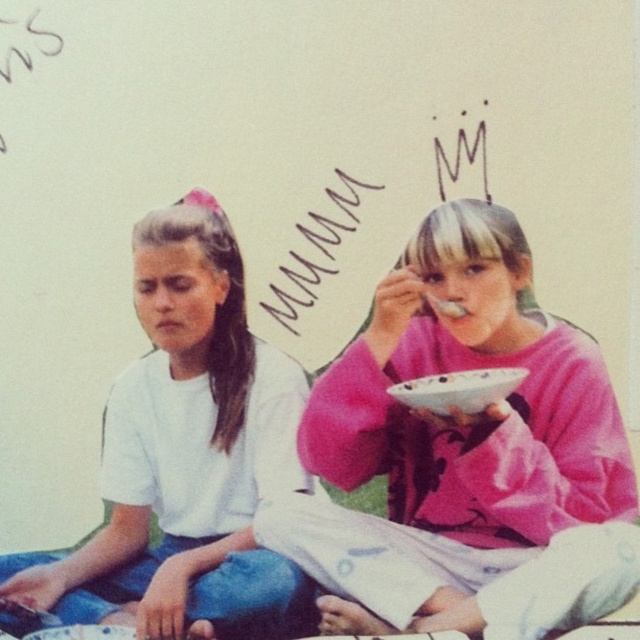
You are a photographer standing in front of the two girls and want to take a photo. You notice two points marked in the scene. The first point is at coordinates point (204, 253) and the second is at point (381, 256). Which point is closer to your camera?

Point (204, 253) is further to the camera than point (381, 256), so the second point is closer to the camera.

You are an interior designer planning to place a decorative item that is 14 inches wide between the pink matte sweater at upper right and the handwritten text at upper center. Based on the scene, will this item fit without overlapping either object?

The distance between the pink matte sweater at upper right and the handwritten text at upper center is 13.84 inches. Since the decorative item is 14 inches wide, it would not fit without overlapping the objects as it is slightly wider than the available space.

Two girls are sitting on a plain wall. The girl on the left is wearing a white T shirt and blue jeans. The girl on the right is holding a bowl and spoon and wearing a bright pink long sleeved shirt. There is a pink matte sweater at upper right. How far apart are the two girls?

The two girls are 2.06 meters apart.